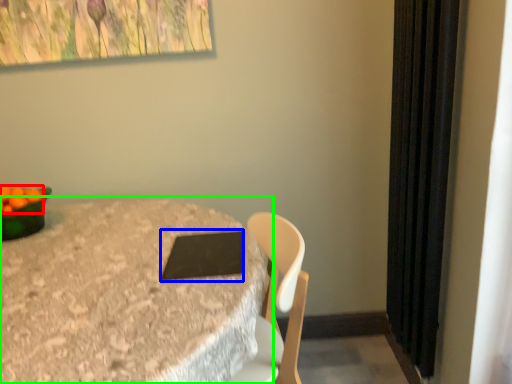
Question: Which is farther away from fruit (highlighted by a red box)? pad (highlighted by a blue box) or table (highlighted by a green box)?

Choices:
 (A) pad
 (B) table

Answer: (A)